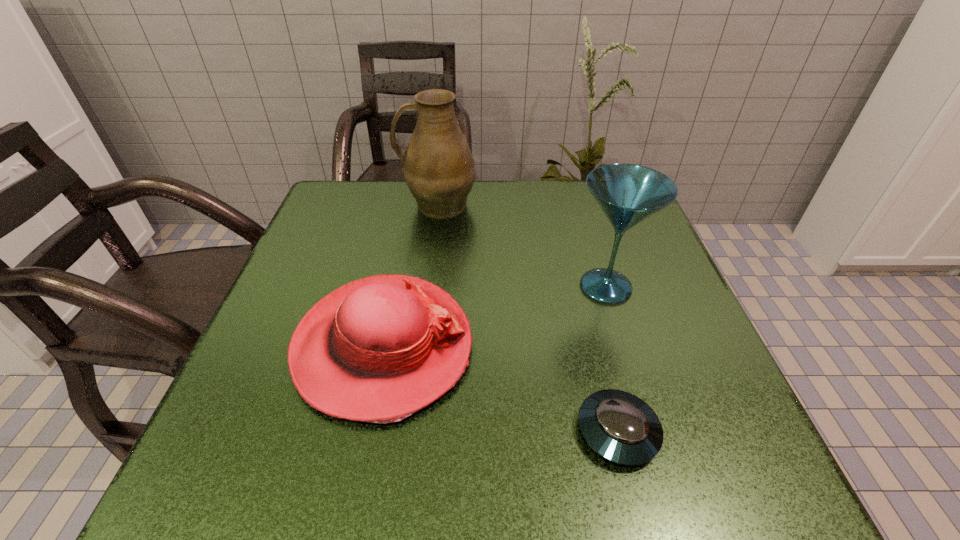
This screenshot has width=960, height=540. I want to click on pitcher, so click(x=438, y=167).

The width and height of the screenshot is (960, 540). I want to click on martini, so click(628, 194).

The height and width of the screenshot is (540, 960). In order to click on hat in this screenshot , I will do `click(379, 349)`.

I want to click on saucer, so click(x=622, y=428).

The height and width of the screenshot is (540, 960). In order to click on vacant region located on the handle side of the farthest object in this screenshot , I will do `click(369, 204)`.

You are a GUI agent. You are given a task and a screenshot of the screen. Output one action in this format:
    pyautogui.click(x=<x>, y=<y>)
    Task: Click on the vacant space situated 0.180m on the handle side of the farthest object
    The height and width of the screenshot is (540, 960).
    Given the screenshot: What is the action you would take?
    pyautogui.click(x=329, y=204)

Identify the location of vacant space located 0.150m on the handle side of the farthest object. The width and height of the screenshot is (960, 540). (341, 204).

The width and height of the screenshot is (960, 540). In order to click on vacant space located 0.180m on the back of the martini in this screenshot , I will do `click(584, 216)`.

At what (x,y) coordinates should I click in order to perform the action: click on free region located 0.180m at the front of the second shortest object with a bow. Please return your answer as a coordinate pair (x, y). Looking at the image, I should click on (574, 346).

The image size is (960, 540). I want to click on vacant position located on the back of the saucer, so click(593, 334).